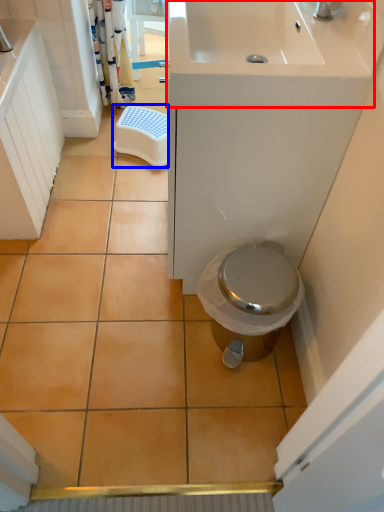
Question: Which of the following is the closest to the observer, sink (highlighted by a red box) or step stool (highlighted by a blue box)?

Choices:
 (A) sink
 (B) step stool

Answer: (A)